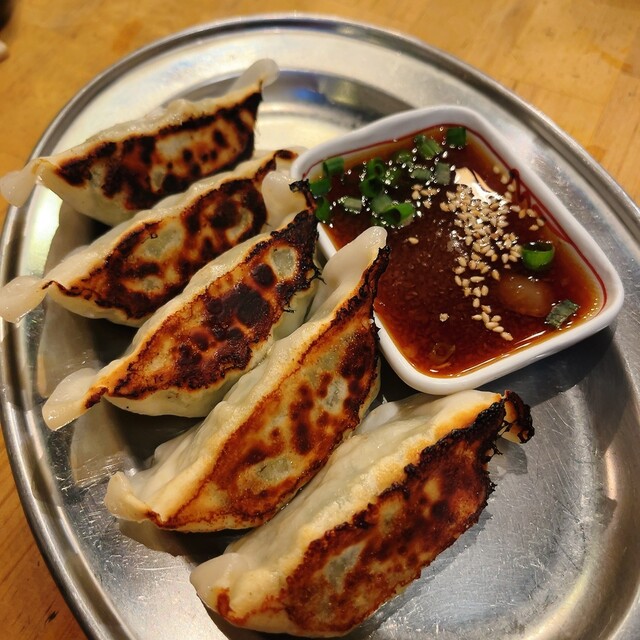
Locate an element on the screen. silver tray is located at coordinates (568, 561).